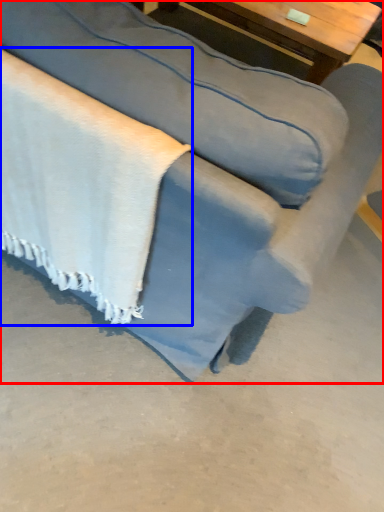
Question: Which object is further to the camera taking this photo, studio couch (highlighted by a red box) or blanket (highlighted by a blue box)?

Choices:
 (A) studio couch
 (B) blanket

Answer: (B)